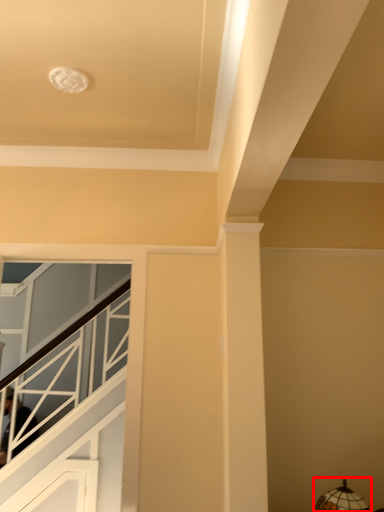
Question: Observing the image, what is the correct spatial positioning of lamp (annotated by the red box) in reference to stairwell?

Choices:
 (A) right
 (B) left

Answer: (A)